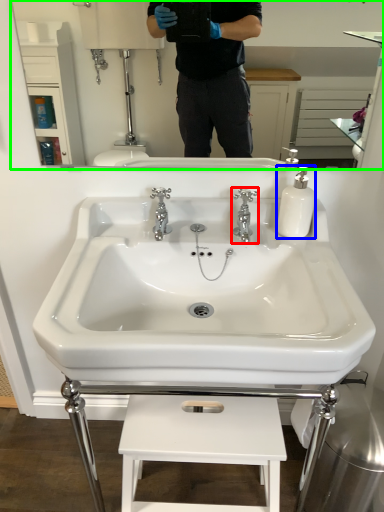
Question: Which object is the closest to the tap (highlighted by a red box)? Choose among these: soap dispenser (highlighted by a blue box) or mirror (highlighted by a green box).

Choices:
 (A) soap dispenser
 (B) mirror

Answer: (A)